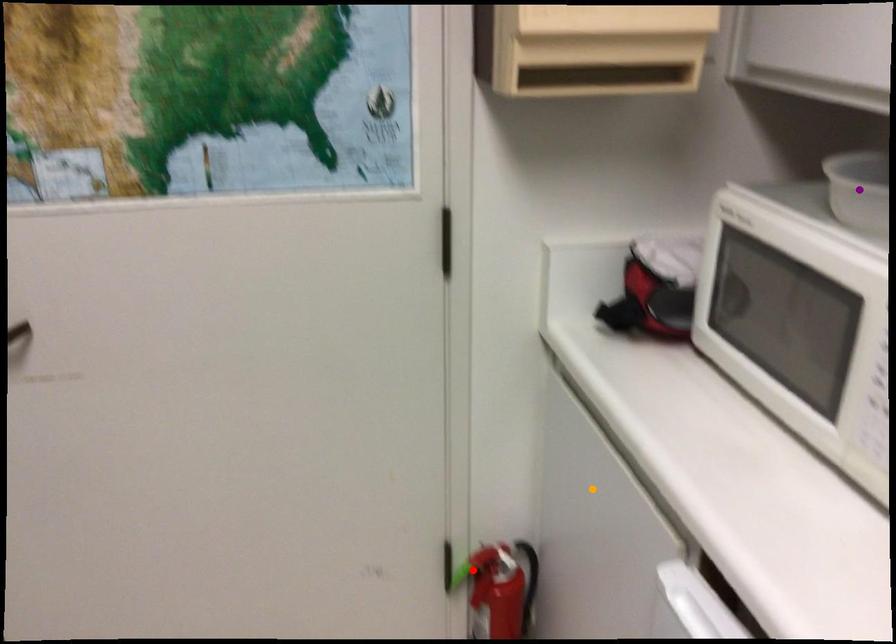
Order these from nearest to farthest:
orange point, red point, purple point

purple point
orange point
red point